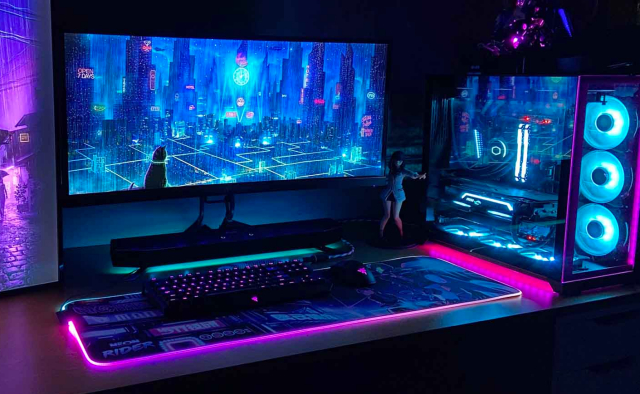
Where is `mouse`? This screenshot has height=394, width=640. mouse is located at coordinates (358, 277).